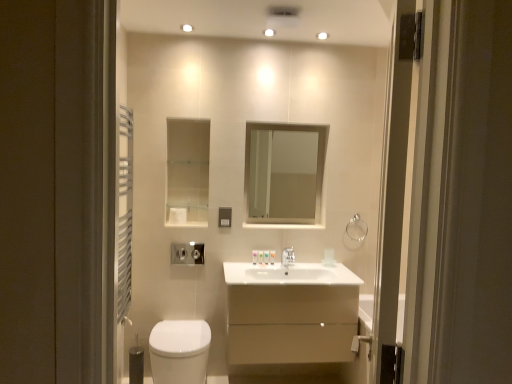
The width and height of the screenshot is (512, 384). Find the location of `translucent plastic soap at center, the 1th toiletry when ordered from left to right`. translucent plastic soap at center, the 1th toiletry when ordered from left to right is located at coordinates (255, 256).

Describe the element at coordinates (393, 188) in the screenshot. I see `transparent glass screen door at right` at that location.

The image size is (512, 384). Describe the element at coordinates (281, 176) in the screenshot. I see `clear glass mirror at center` at that location.

The image size is (512, 384). Find the location of `clear glass mirror at center`. clear glass mirror at center is located at coordinates point(281,176).

How much space does white glossy toiletries at center, which ranks as the fourth toiletry in left-to-right order, occupy horizontally?

white glossy toiletries at center, which ranks as the fourth toiletry in left-to-right order, is 1.63 inches in width.

What is the approximate height of silver metallic faucet at center?

silver metallic faucet at center is 5.91 inches tall.

The image size is (512, 384). In order to click on silver metallic faucet at center in this screenshot , I will do `click(288, 257)`.

This screenshot has height=384, width=512. Identify the location of translucent plastic soap at center, the 1th toiletry when ordered from left to right. (255, 256).

From a real-world perspective, is white matte toilet paper at center physically located above or below satin nickel light switch at upper center?

Clearly, from a real-world perspective, white matte toilet paper at center is below satin nickel light switch at upper center.

Is white matte toilet paper at center to the left or to the right of satin nickel light switch at upper center in the image?

In the image, white matte toilet paper at center appears on the left side of satin nickel light switch at upper center.

Where is `light switch to the right of white matte toilet paper at center`? light switch to the right of white matte toilet paper at center is located at coordinates (225, 217).

Is white matte toilet paper at center wider than satin nickel light switch at upper center?

Correct, the width of white matte toilet paper at center exceeds that of satin nickel light switch at upper center.

Could white metal towel rack at left be considered to be inside white matte toilet paper at center?

No.

At what (x,y) coordinates should I click in order to perform the action: click on shower curtain lying in front of the white matte toilet paper at center. Please return your answer as a coordinate pair (x, y). The image size is (512, 384). Looking at the image, I should click on (124, 211).

Is white matte toilet paper at center further to the viewer compared to white metal towel rack at left?

That is True.

In the scene shown: Is white matte toilet paper at center positioned far away from white metal towel rack at left?

No, white matte toilet paper at center is not far away from white metal towel rack at left.

Could you tell me if white metal towel rack at left is turned towards clear glass mirror at center?

No, white metal towel rack at left is not turned towards clear glass mirror at center.

From the image's perspective, is white metal towel rack at left below clear glass mirror at center?

Yes.

Considering the relative sizes of white metal towel rack at left and clear glass mirror at center in the image provided, is white metal towel rack at left wider than clear glass mirror at center?

Yes, white metal towel rack at left is wider than clear glass mirror at center.

Which is in front, point (124, 129) or point (326, 131)?

Point (124, 129)

Between translucent plastic toiletries at center, which ranks as the second toiletry in left-to-right order, and white glossy toiletries at center, which ranks as the fourth toiletry in left-to-right order, which one is positioned behind?

white glossy toiletries at center, which ranks as the fourth toiletry in left-to-right order.

Which of these two, translucent plastic toiletries at center, which ranks as the second toiletry in left-to-right order, or white glossy toiletries at center, marked as the first toiletry in a right-to-left arrangement, is thinner?

translucent plastic toiletries at center, which ranks as the second toiletry in left-to-right order, is thinner.

How many degrees apart are the facing directions of translucent plastic toiletries at center, which appears as the 3th toiletry when viewed from the right, and white glossy toiletries at center, which ranks as the fourth toiletry in left-to-right order?

There is a 0.0708-degree angle between the facing directions of translucent plastic toiletries at center, which appears as the 3th toiletry when viewed from the right, and white glossy toiletries at center, which ranks as the fourth toiletry in left-to-right order.

How much distance is there between translucent plastic toiletries at center, which ranks as the second toiletry in left-to-right order, and white glossy toiletries at center, which ranks as the fourth toiletry in left-to-right order?

They are 6.80 centimeters apart.

Considering the sizes of matte beige cabinet at center and white glossy toiletries at center, which ranks as the fourth toiletry in left-to-right order, in the image, is matte beige cabinet at center bigger or smaller than white glossy toiletries at center, which ranks as the fourth toiletry in left-to-right order,?

matte beige cabinet at center is bigger than white glossy toiletries at center, which ranks as the fourth toiletry in left-to-right order.

From a real-world perspective, between matte beige cabinet at center and white glossy toiletries at center, marked as the first toiletry in a right-to-left arrangement, who is vertically lower?

matte beige cabinet at center is physically lower.

Is matte beige cabinet at center facing towards white glossy toiletries at center, marked as the first toiletry in a right-to-left arrangement?

No, matte beige cabinet at center is not oriented towards white glossy toiletries at center, marked as the first toiletry in a right-to-left arrangement.

Where is `bathroom cabinet that is under the white glossy toiletries at center, marked as the first toiletry in a right-to-left arrangement (from a real-world perspective)`? bathroom cabinet that is under the white glossy toiletries at center, marked as the first toiletry in a right-to-left arrangement (from a real-world perspective) is located at coordinates (290, 314).

Can you confirm if transparent glass screen door at right is positioned to the right of white matte toilet paper at center?

Yes.

Is transparent glass screen door at right taller than white matte toilet paper at center?

Yes, transparent glass screen door at right is taller than white matte toilet paper at center.

Is white matte toilet paper at center located within transparent glass screen door at right?

No, white matte toilet paper at center is not a part of transparent glass screen door at right.

Which is closer to the camera, (408, 87) or (170, 216)?

Point (408, 87) appears to be closer to the viewer than point (170, 216).

Would you say satin nickel light switch at upper center is to the left or to the right of translucent plastic soap at center, the fourth toiletry positioned from the right, in the picture?

Clearly, satin nickel light switch at upper center is on the left of translucent plastic soap at center, the fourth toiletry positioned from the right, in the image.

Considering the sizes of objects satin nickel light switch at upper center and translucent plastic soap at center, the 1th toiletry when ordered from left to right, in the image provided, who is taller, satin nickel light switch at upper center or translucent plastic soap at center, the 1th toiletry when ordered from left to right,?

With more height is satin nickel light switch at upper center.

Is satin nickel light switch at upper center bigger than translucent plastic soap at center, the fourth toiletry positioned from the right?

Yes.

In the scene shown: Is translucent plastic soap at center, the 1th toiletry when ordered from left to right, at the back of satin nickel light switch at upper center?

No.

Image resolution: width=512 pixels, height=384 pixels. I want to click on light switch located on the right of white matte toilet paper at center, so click(225, 217).

In order to click on shower curtain above the white matte toilet paper at center (from a real-world perspective) in this screenshot , I will do `click(124, 211)`.

Estimate the real-world distances between objects in this image. Which object is closer to clear glass towel bar at upper right, white glossy toiletries at center, which ranks as the fourth toiletry in left-to-right order, or matte beige cabinet at center?

The object closer to clear glass towel bar at upper right is white glossy toiletries at center, which ranks as the fourth toiletry in left-to-right order.

Which object lies further to the anchor point white glossy sink at center, transparent glass screen door at right or silver metallic faucet at center?

Based on the image, transparent glass screen door at right appears to be further to white glossy sink at center.

Which object lies further to the anchor point translucent plastic soap at center, which ranks as the third toiletry in left-to-right order, white glossy sink at center or clear glass mirror at center?

Based on the image, clear glass mirror at center appears to be further to translucent plastic soap at center, which ranks as the third toiletry in left-to-right order.

From the image, which object appears to be nearer to satin nickel light switch at upper center, matte beige cabinet at center or silver metallic faucet at center?

Among the two, silver metallic faucet at center is located nearer to satin nickel light switch at upper center.

When comparing their distances from white matte toilet paper at center, does silver metallic faucet at center or translucent plastic soap at center, the 1th toiletry when ordered from left to right, seem closer?

translucent plastic soap at center, the 1th toiletry when ordered from left to right, is closer to white matte toilet paper at center.

Considering their positions, is translucent plastic soap at center, the fourth toiletry positioned from the right, positioned closer to transparent glass screen door at right than satin nickel light switch at upper center?

translucent plastic soap at center, the fourth toiletry positioned from the right, lies closer to transparent glass screen door at right than the other object.

Estimate the real-world distances between objects in this image. Which object is further from matte beige cabinet at center, translucent plastic soap at center, which ranks as the second toiletry in right-to-left order, or translucent plastic soap at center, the fourth toiletry positioned from the right?

translucent plastic soap at center, the fourth toiletry positioned from the right, lies further to matte beige cabinet at center than the other object.

When comparing their distances from translucent plastic soap at center, the fourth toiletry positioned from the right, does white glossy toiletries at center, which ranks as the fourth toiletry in left-to-right order, or transparent glass screen door at right seem further?

The object further to translucent plastic soap at center, the fourth toiletry positioned from the right, is transparent glass screen door at right.

The width and height of the screenshot is (512, 384). Find the location of `tap between white matte toilet paper at center and white glossy toilet at lower left vertically`. tap between white matte toilet paper at center and white glossy toilet at lower left vertically is located at coordinates (288, 257).

Locate an element on the screen. tap between white glossy toiletries at center, which ranks as the fourth toiletry in left-to-right order, and clear glass towel bar at upper right, in the horizontal direction is located at coordinates (288, 257).

I want to click on mirror between white matte toilet paper at center and white glossy sink at center, so click(x=281, y=176).

The width and height of the screenshot is (512, 384). In order to click on toiletry between translucent plastic soap at center, which ranks as the third toiletry in left-to-right order, and silver metallic faucet at center from left to right in this screenshot , I will do `click(272, 257)`.